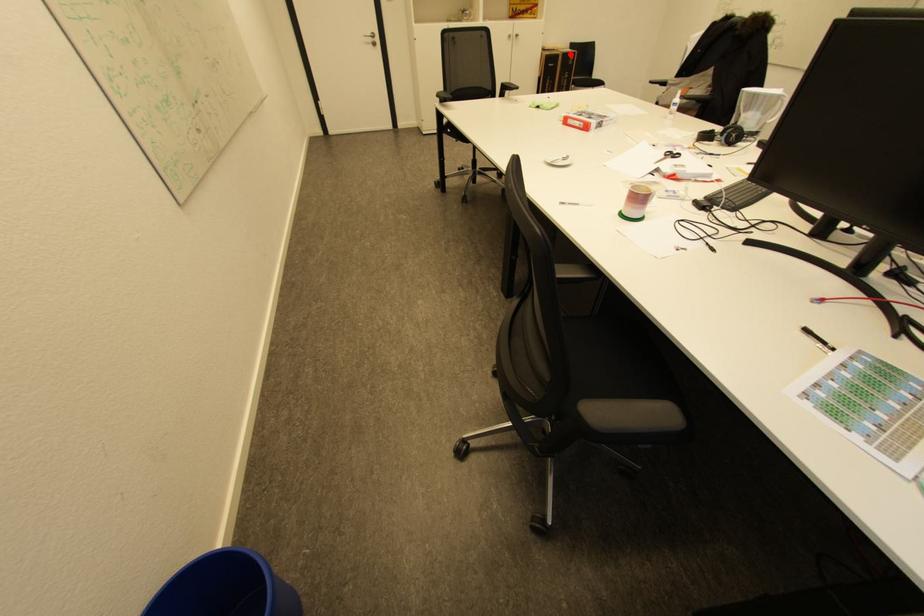
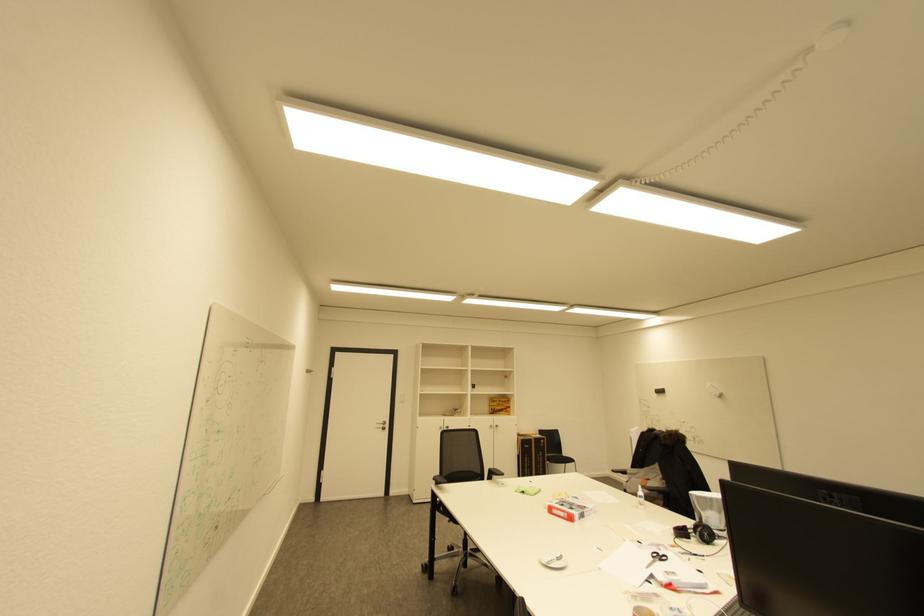
In the second image, find the point that corresponds to the highlighted location in the first image.

(541, 439)